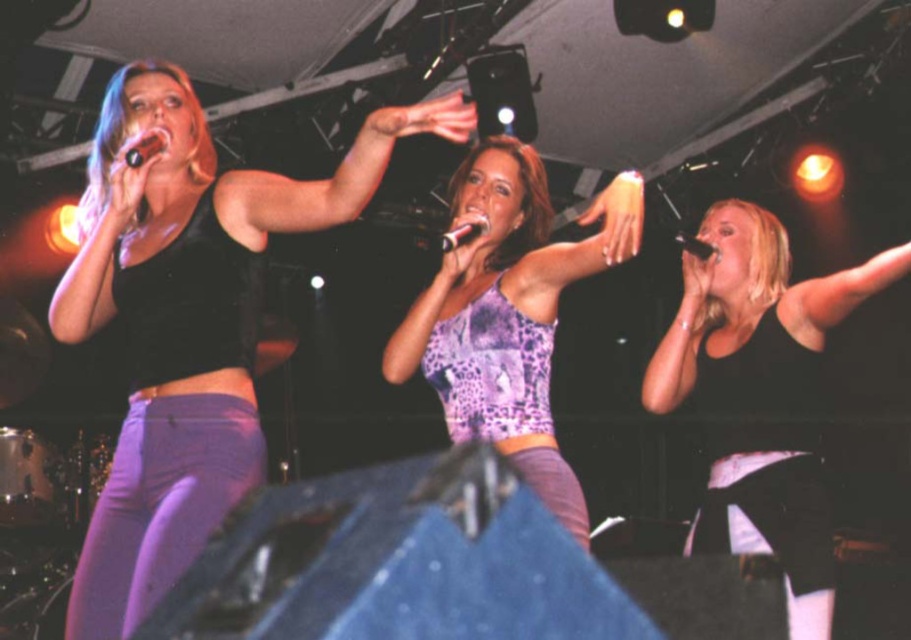
You are a photographer positioned at the back of the venue. You need to capture a closeup shot of the shiny black microphone at upper left while ensuring the black matte tank top at left is visible in the frame. Is the microphone wide enough to be the main focus without the tank top blocking it?

The black matte tank top at left is wider than the shiny black microphone at upper left, so the tank top might block the microphone if positioned too closely. Adjust the angle to ensure the microphone remains the focus while still showing the tank top.

You are an audience member sitting at the front row of the performance. You notice two microphones on the stage. Which one is positioned to the left side from your perspective? The black plastic microphone at center or the black matte microphone at upper center?

The black plastic microphone at center is positioned to the left of the black matte microphone at upper center from your perspective.